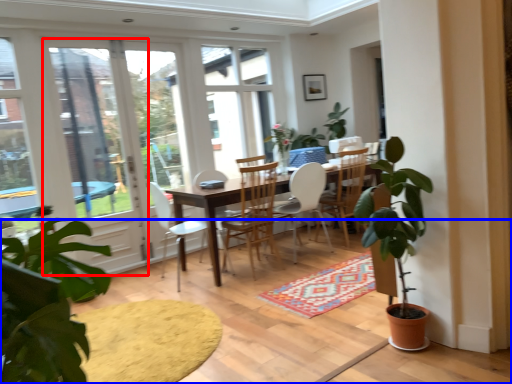
Question: Which object is further to the camera taking this photo, screen door (highlighted by a red box) or carpeting (highlighted by a blue box)?

Choices:
 (A) screen door
 (B) carpeting

Answer: (A)